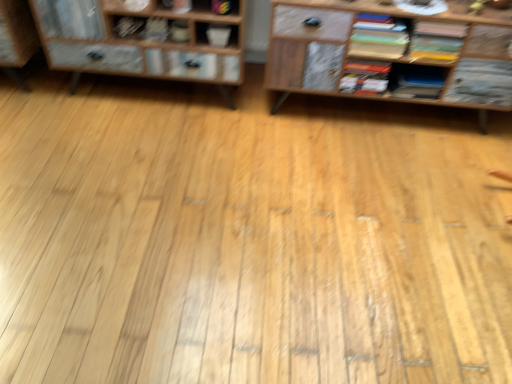
Question: Can we say matte yellow book at upper right, marked as the sixth book in a left-to-right arrangement, lies outside matte gray book at upper center, marked as the 5th book in a right-to-left arrangement?

Choices:
 (A) no
 (B) yes

Answer: (B)

Question: Does matte yellow book at upper right, marked as the sixth book in a left-to-right arrangement, have a lesser height compared to matte gray book at upper center, marked as the 5th book in a right-to-left arrangement?

Choices:
 (A) no
 (B) yes

Answer: (A)

Question: Is matte yellow book at upper right, the 1th book from the right, in front of matte gray book at upper center, marked as the 2th book in a left-to-right arrangement?

Choices:
 (A) yes
 (B) no

Answer: (A)

Question: Does matte yellow book at upper right, marked as the sixth book in a left-to-right arrangement, have a greater width compared to matte gray book at upper center, marked as the 5th book in a right-to-left arrangement?

Choices:
 (A) yes
 (B) no

Answer: (A)

Question: Can you confirm if matte yellow book at upper right, marked as the sixth book in a left-to-right arrangement, is bigger than matte gray book at upper center, marked as the 5th book in a right-to-left arrangement?

Choices:
 (A) no
 (B) yes

Answer: (B)

Question: Is matte yellow book at upper right, the 1th book from the right, thinner than matte gray book at upper center, marked as the 2th book in a left-to-right arrangement?

Choices:
 (A) no
 (B) yes

Answer: (A)

Question: Is hardcover book at center, which ranks as the 3th book in left-to-right order, surrounded by matte black book at upper left, which appears as the sixth book when viewed from the right?

Choices:
 (A) yes
 (B) no

Answer: (B)

Question: Is the surface of matte black book at upper left, which appears as the sixth book when viewed from the right, in direct contact with hardcover book at center, which ranks as the 3th book in left-to-right order?

Choices:
 (A) yes
 (B) no

Answer: (B)

Question: Is matte black book at upper left, which appears as the sixth book when viewed from the right, at the right side of hardcover book at center, which ranks as the 3th book in left-to-right order?

Choices:
 (A) yes
 (B) no

Answer: (B)

Question: From a real-world perspective, is matte black book at upper left, placed as the first book when sorted from left to right, positioned under hardcover book at center, which ranks as the 3th book in left-to-right order, based on gravity?

Choices:
 (A) no
 (B) yes

Answer: (A)

Question: From the image's perspective, would you say matte black book at upper left, placed as the first book when sorted from left to right, is shown under hardcover book at center, which ranks as the 3th book in left-to-right order?

Choices:
 (A) yes
 (B) no

Answer: (B)

Question: Is matte black book at upper left, which appears as the sixth book when viewed from the right, bigger than hardcover book at center, which ranks as the 3th book in left-to-right order?

Choices:
 (A) yes
 (B) no

Answer: (B)

Question: Is matte gray book at upper center, marked as the 5th book in a right-to-left arrangement, oriented away from matte black book at upper left, placed as the first book when sorted from left to right?

Choices:
 (A) yes
 (B) no

Answer: (B)